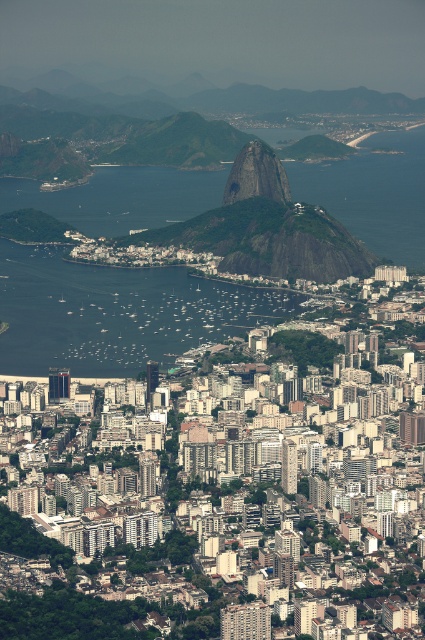
Between clear blue water at center and green rock formation at center, which one appears on the left side from the viewer's perspective?

clear blue water at center

Is clear blue water at center taller than green rock formation at center?

Correct, clear blue water at center is much taller as green rock formation at center.

Locate an element on the screen. The width and height of the screenshot is (425, 640). clear blue water at center is located at coordinates (116, 312).